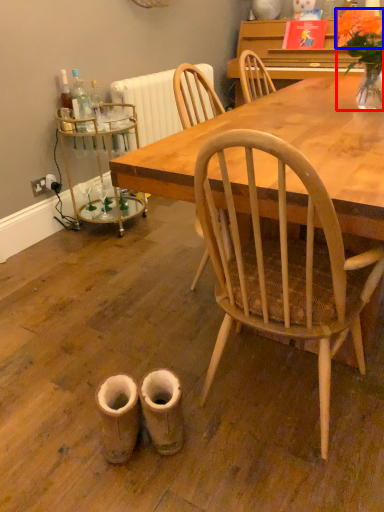
Question: Which object appears closest to the camera in this image, houseplant (highlighted by a red box) or flower (highlighted by a blue box)?

Choices:
 (A) houseplant
 (B) flower

Answer: (A)